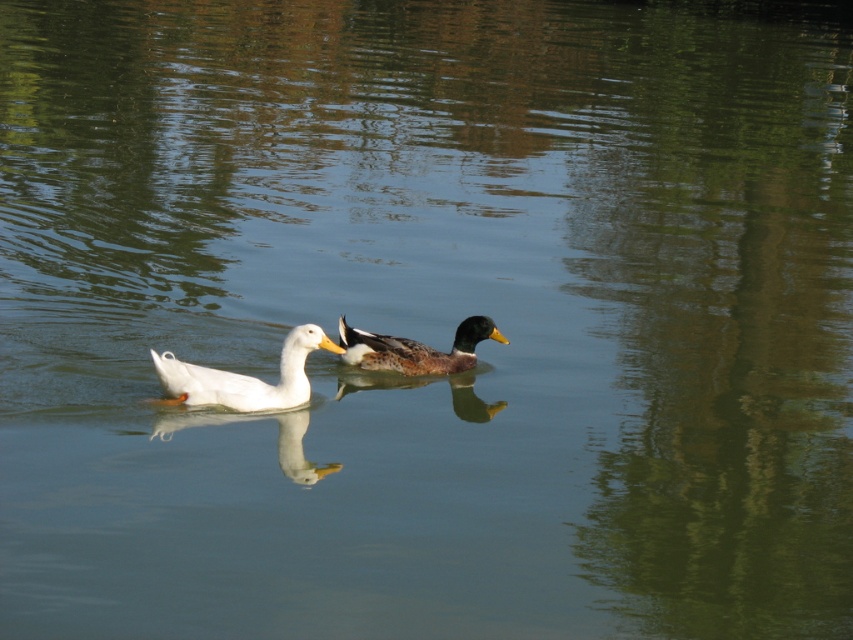
You are standing at the edge of the pond and see the white matte duck at center. Can you confirm if the duck is located exactly at the coordinates point (242, 378)?

Yes, the white matte duck at center is located exactly at point (242, 378).

You are observing two points on the water surface in the image. The first point is labeled as point (219, 385) and the second is point (457, 328). From your perspective, which point appears closer to you?

Point (219, 385) is closer to the camera than point (457, 328).